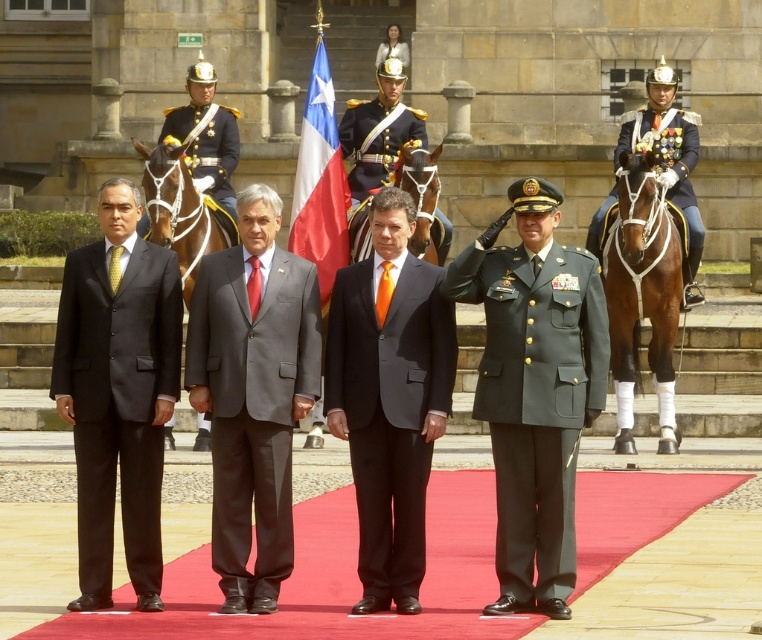
You are a photographer standing behind the matte black suit at left and the brown leather horse at center. You need to capture a photo where both subjects are in frame. Is there enough space between them to fit both in the shot?

The matte black suit at left might be wider than brown leather horse at center, so there may not be enough space between them to fit both in the photo.

You are a photographer at this event. You want to capture a photo where both the brown glossy horse at right and the brown leather horse at center are visible. Which horse should you position closer to the edge of the frame to ensure both fit in the shot?

To ensure both the brown glossy horse at right and the brown leather horse at center fit in the shot, position the brown glossy horse at right closer to the edge of the frame since it is wider than the brown leather horse at center.